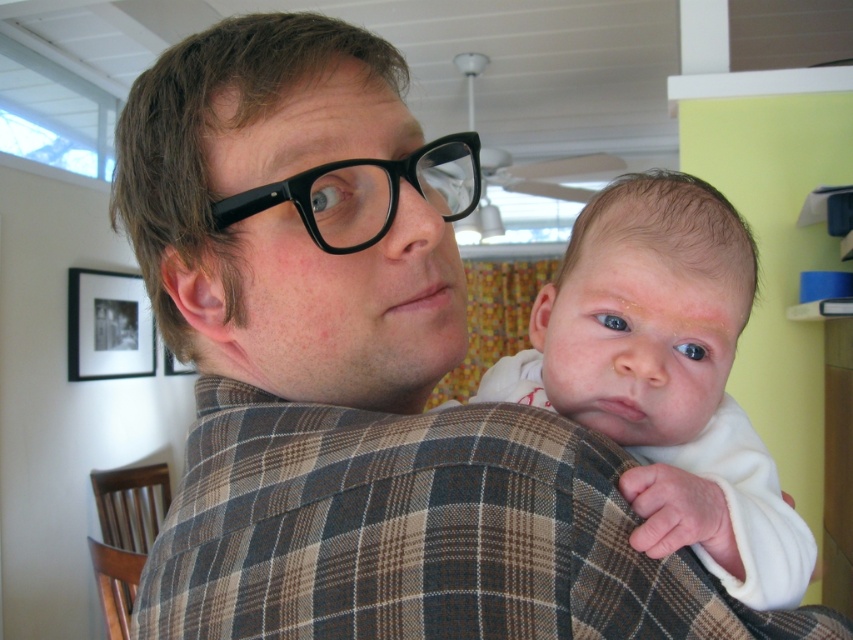
You are a photographer trying to capture the baby in the center. You notice a point at coordinates (665, 378). Where is this point located on the baby?

The point at coordinates (665, 378) is located on the white soft baby at center.

You are a photographer setting up for a family photo. You notice the white soft baby at center and the black plastic glasses at center in the scene. Since you want to ensure both subjects are in focus, which one should you adjust your camera focus to prioritize based on their sizes?

The white soft baby at center is taller than the black plastic glasses at center, so you should prioritize focusing on the white soft baby at center to ensure both are in focus.

You are a photographer trying to capture a closeup of the black plastic glasses at center without including the white soft baby at center in the frame. Is this possible given their positions?

The white soft baby at center is positioned on the right side of black plastic glasses at center, so if you move your camera to the left side of the glasses, you can capture the black plastic glasses at center without the baby in the frame.